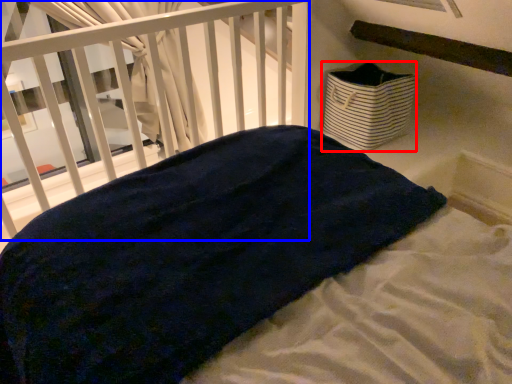
Question: Which object appears farthest to the camera in this image, basket (highlighted by a red box) or infant bed (highlighted by a blue box)?

Choices:
 (A) basket
 (B) infant bed

Answer: (A)